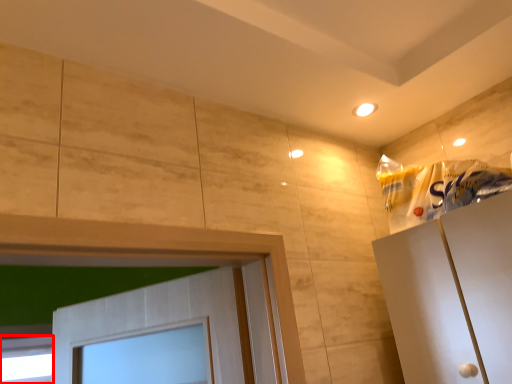
Question: Where is window (annotated by the red box) located in relation to material in the image?

Choices:
 (A) right
 (B) left

Answer: (B)